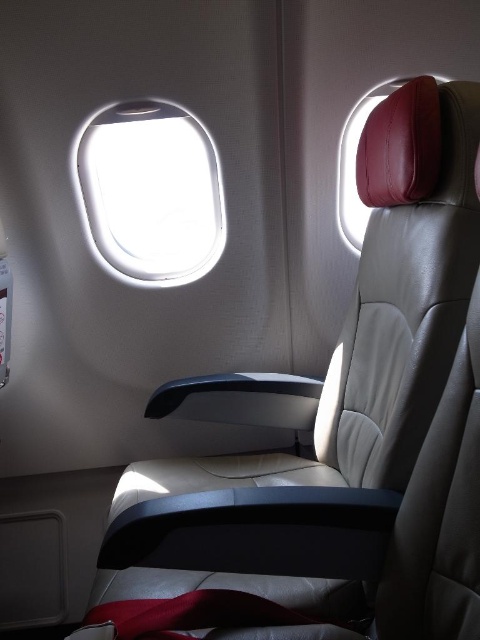
Question: From the image, what is the correct spatial relationship of transparent glass airplane window at upper center in relation to leather headrest at upper right?

Choices:
 (A) below
 (B) above

Answer: (A)

Question: Is transparent glass airplane window at upper center below leather headrest at upper right?

Choices:
 (A) no
 (B) yes

Answer: (B)

Question: Which point is farther to the camera?

Choices:
 (A) transparent glass airplane window at upper center
 (B) leather headrest at upper right

Answer: (B)

Question: Considering the relative positions of transparent glass airplane window at upper center and leather headrest at upper right in the image provided, where is transparent glass airplane window at upper center located with respect to leather headrest at upper right?

Choices:
 (A) below
 (B) above

Answer: (A)

Question: Among these objects, which one is nearest to the camera?

Choices:
 (A) leather headrest at upper right
 (B) transparent glass airplane window at upper center

Answer: (B)